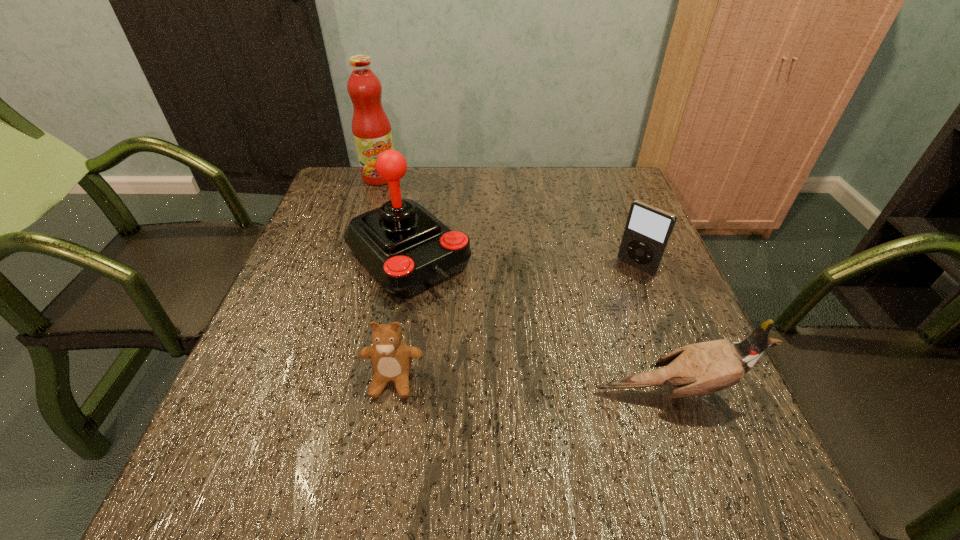
Locate an element on the screen. The height and width of the screenshot is (540, 960). vacant area at the near left corner is located at coordinates (257, 399).

You are a GUI agent. You are given a task and a screenshot of the screen. Output one action in this format:
    pyautogui.click(x=<x>, y=<y>)
    Task: Click on the vacant space at the far right corner of the desktop
    
    Given the screenshot: What is the action you would take?
    pyautogui.click(x=611, y=181)

I want to click on free spot between the farthest object and the bird, so click(525, 285).

Locate an element on the screen. free spot between the bird and the fruit juice is located at coordinates (525, 285).

Locate an element on the screen. This screenshot has width=960, height=540. free space between the teddy bear and the fourth tallest object is located at coordinates (515, 323).

I want to click on free spot between the second shortest object and the bird, so click(x=654, y=329).

The width and height of the screenshot is (960, 540). What are the coordinates of `blank region between the bird and the second shortest object` in the screenshot? It's located at (654, 329).

Where is `vacant space in between the bird and the teddy bear`? vacant space in between the bird and the teddy bear is located at coordinates (532, 386).

Image resolution: width=960 pixels, height=540 pixels. What are the coordinates of `free space between the bird and the teddy bear` in the screenshot? It's located at (532, 386).

At what (x,y) coordinates should I click in order to perform the action: click on object that stands as the fourth closest to the farthest object. Please return your answer as a coordinate pair (x, y). The height and width of the screenshot is (540, 960). Looking at the image, I should click on (697, 369).